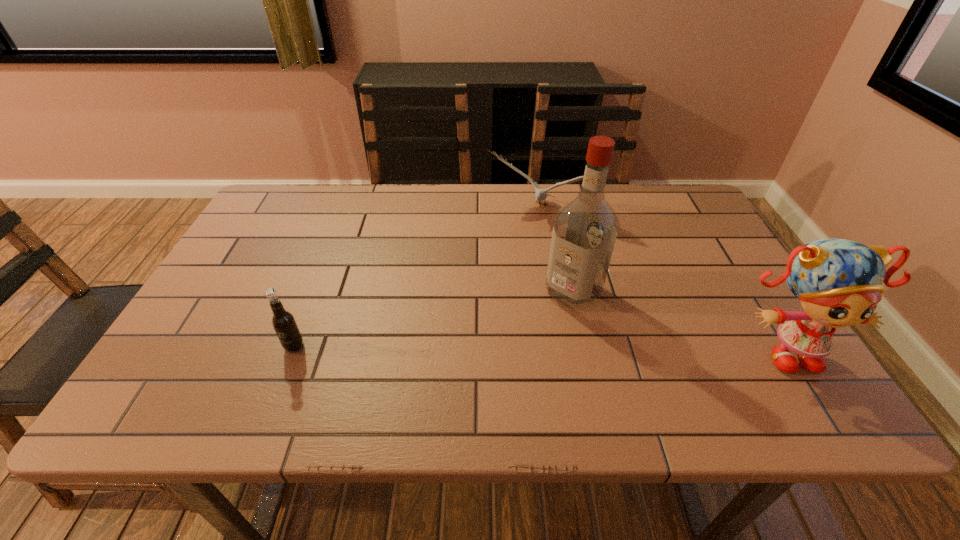
The height and width of the screenshot is (540, 960). In order to click on free space that is in between the leftmost object and the tallest object in this screenshot , I will do `click(434, 319)`.

You are a GUI agent. You are given a task and a screenshot of the screen. Output one action in this format:
    pyautogui.click(x=<x>, y=<y>)
    Task: Click on the free spot between the third shortest object and the root beer
    This screenshot has height=540, width=960.
    Given the screenshot: What is the action you would take?
    [539, 347]

Where is `free space between the second farthest object and the root beer`? Image resolution: width=960 pixels, height=540 pixels. free space between the second farthest object and the root beer is located at coordinates (434, 319).

This screenshot has width=960, height=540. In order to click on unoccupied area between the root beer and the tallest object in this screenshot , I will do `click(434, 319)`.

Identify which object is located as the nearest to the third nearest object. Please provide its 2D coordinates. Your answer should be formatted as a tuple, i.e. [(x, y)], where the tuple contains the x and y coordinates of a point satisfying the conditions above.

[(540, 194)]

Identify which object is located as the third nearest to the root beer. Please provide its 2D coordinates. Your answer should be formatted as a tuple, i.e. [(x, y)], where the tuple contains the x and y coordinates of a point satisfying the conditions above.

[(838, 281)]